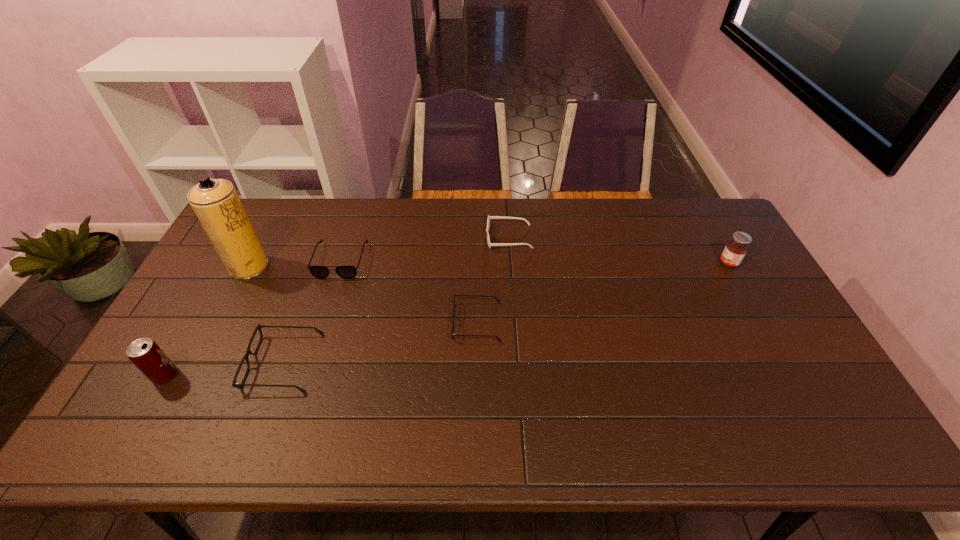
The image size is (960, 540). I want to click on free space located with the lenses of the sunglasses facing outward, so click(x=443, y=238).

Find the location of `free location located 0.190m with the lenses of the sunglasses facing outward`. free location located 0.190m with the lenses of the sunglasses facing outward is located at coordinates (431, 238).

Locate an element on the screen. The image size is (960, 540). free space located with the lenses of the sunglasses facing outward is located at coordinates (394, 238).

Locate an element on the screen. vacant space located on the right of the tallest object is located at coordinates (367, 267).

Identify the location of vacant space located 0.170m on the label side of the rightmost object. The image size is (960, 540). (666, 264).

At what (x,y) coordinates should I click in order to perform the action: click on vacant point located on the label side of the rightmost object. Please return your answer as a coordinate pair (x, y). Looking at the image, I should click on (648, 264).

You are a GUI agent. You are given a task and a screenshot of the screen. Output one action in this format:
    pyautogui.click(x=<x>, y=<y>)
    Task: Click on the vacant space located 0.050m on the label side of the rightmost object
    This screenshot has height=540, width=960.
    Given the screenshot: What is the action you would take?
    pyautogui.click(x=704, y=264)

Image resolution: width=960 pixels, height=540 pixels. Identify the location of vacant region located on the front-facing side of the farthest spectacles. (301, 383).

At what (x,y) coordinates should I click in order to perform the action: click on free space located 0.330m on the back of the beer can. Please return your answer as a coordinate pair (x, y). The height and width of the screenshot is (540, 960). Looking at the image, I should click on (222, 275).

Where is `object at the far edge`? Image resolution: width=960 pixels, height=540 pixels. object at the far edge is located at coordinates (489, 217).